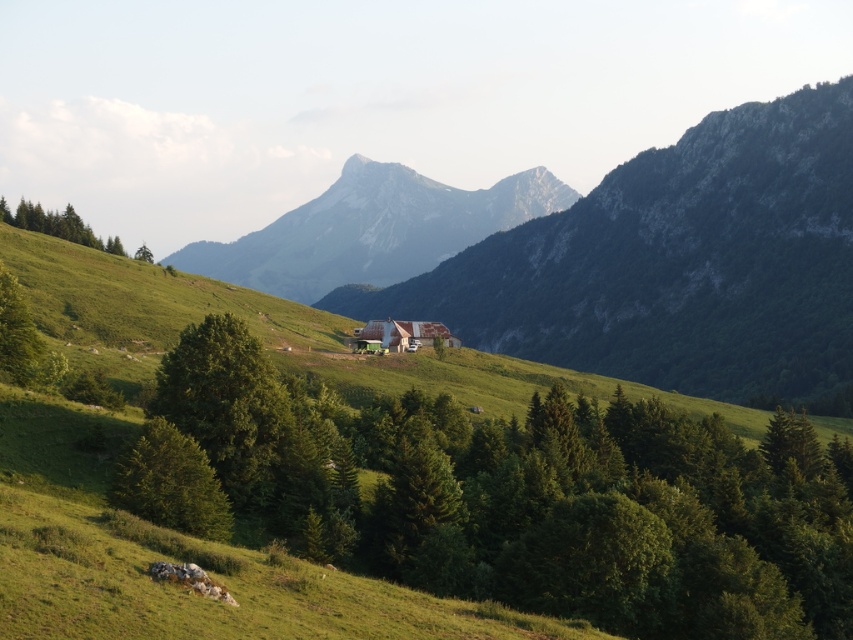
You are planning a hiking route from the green matte tree at upper left to the gray rocky mountain at center. Which direction should you head to reach the mountain?

The gray rocky mountain at center is taller than the green matte tree at upper left, so you should head towards the center of the image where the mountain is located to reach it.

You are planning to build a hiking trail that must pass between the green matte tree at center and the gray rocky mountain at center. Which side of the trail should be closer to the thinner object to ensure stability?

The green matte tree at center is thinner than the gray rocky mountain at center, so the trail should be closer to the green matte tree at center to ensure stability as it poses less structural risk compared to the rocky mountain.

You are standing at the point labeled point [397,218] and want to walk to the point labeled point [575,589]. Which direction should you move to get closer to your destination?

To move from point [397,218] to point [575,589], you should move towards the upper right direction since point [575,589] is further away from the viewer compared to point [397,218].